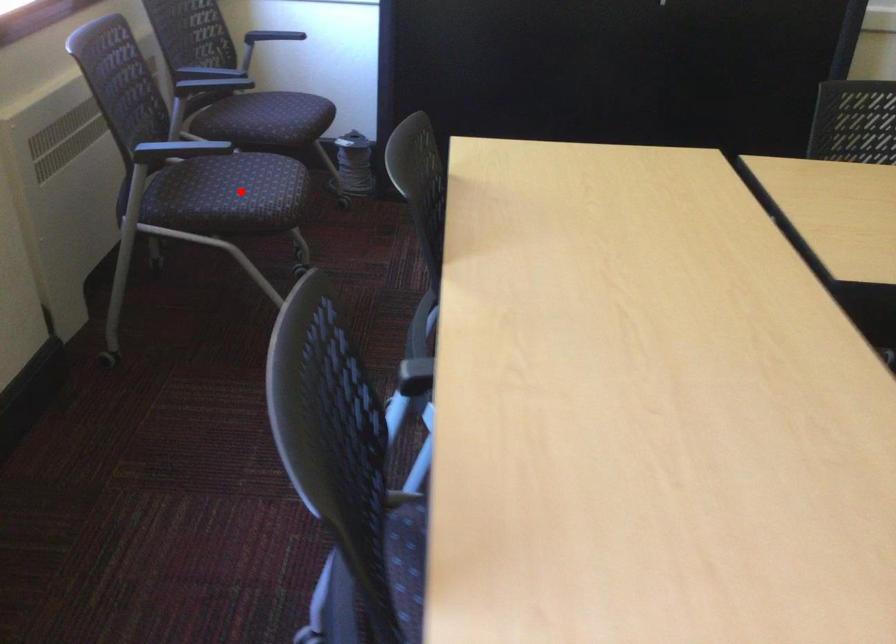
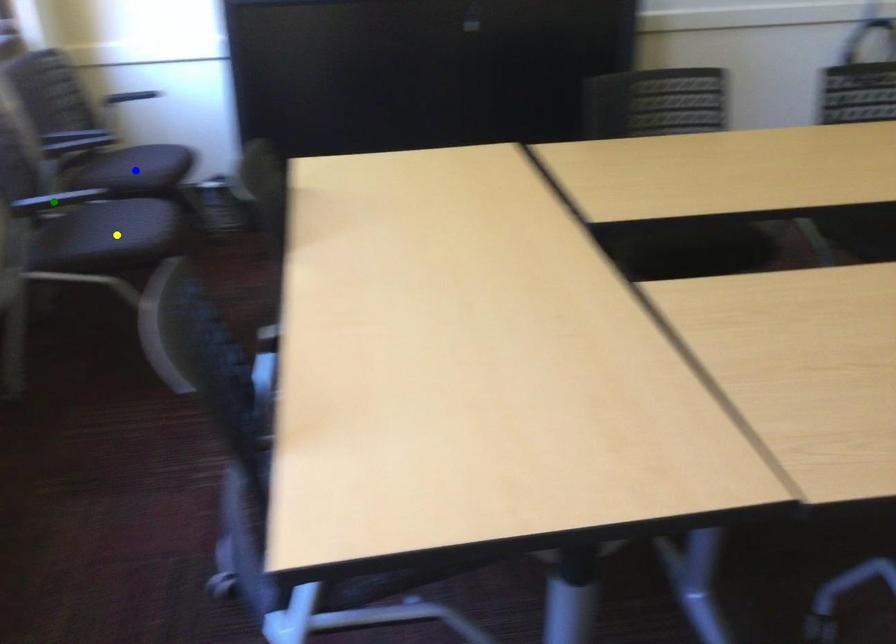
Question: I am providing you with two images of the same scene from different viewpoints. A red point is marked on the first image. You are given multiple points on the second image. Which point in image 2 represents the same 3d spot as the red point in image 1?

Choices:
 (A) green point
 (B) blue point
 (C) yellow point

Answer: (C)